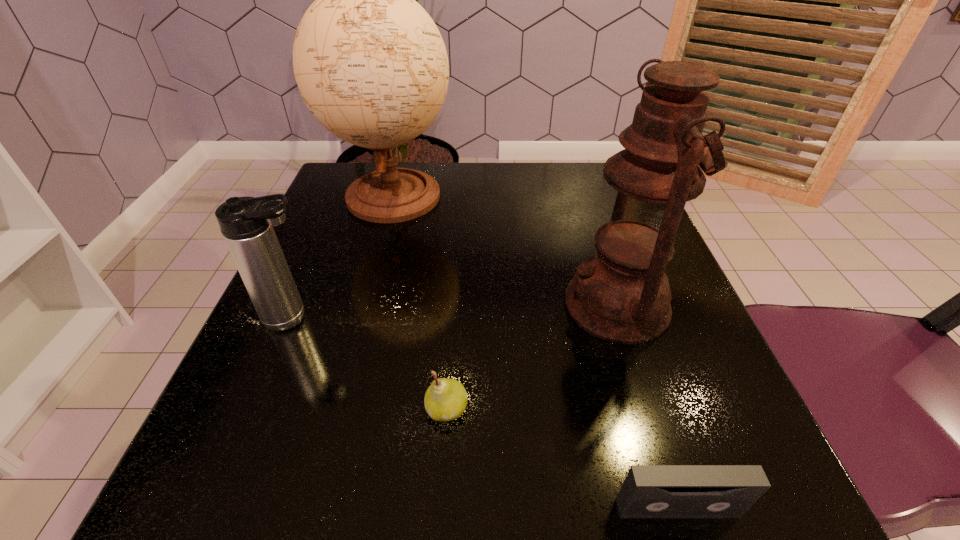
Where is `object that is at the far edge`? The image size is (960, 540). object that is at the far edge is located at coordinates (370, 64).

Locate an element on the screen. This screenshot has width=960, height=540. object that is at the near edge is located at coordinates (649, 491).

Where is `globe that is at the left edge`? The height and width of the screenshot is (540, 960). globe that is at the left edge is located at coordinates (370, 64).

At what (x,y) coordinates should I click in order to perform the action: click on thermos bottle positioned at the left edge. Please return your answer as a coordinate pair (x, y). Looking at the image, I should click on (246, 223).

The width and height of the screenshot is (960, 540). Find the location of `oil lamp at the right edge`. oil lamp at the right edge is located at coordinates (621, 294).

This screenshot has width=960, height=540. I want to click on videotape that is at the right edge, so click(x=649, y=491).

What are the coordinates of `object situated at the far left corner` in the screenshot? It's located at (370, 64).

You are a GUI agent. You are given a task and a screenshot of the screen. Output one action in this format:
    pyautogui.click(x=<x>, y=<y>)
    Task: Click on the object at the near right corner
    The width and height of the screenshot is (960, 540).
    Given the screenshot: What is the action you would take?
    pyautogui.click(x=649, y=491)

Image resolution: width=960 pixels, height=540 pixels. What are the coordinates of `vacant space at the far edge` in the screenshot? It's located at (518, 201).

Where is `blank space at the near edge of the desktop`? The image size is (960, 540). blank space at the near edge of the desktop is located at coordinates (506, 503).